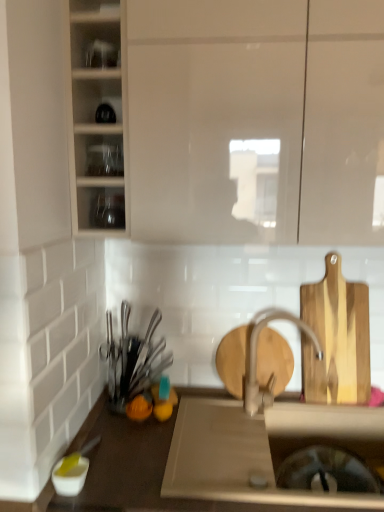
Locate an element on the screen. The image size is (384, 512). free space between wooden cutting board at right and white glossy bowl at lower left, marked as the first tableware in a front-to-back arrangement is located at coordinates (198, 443).